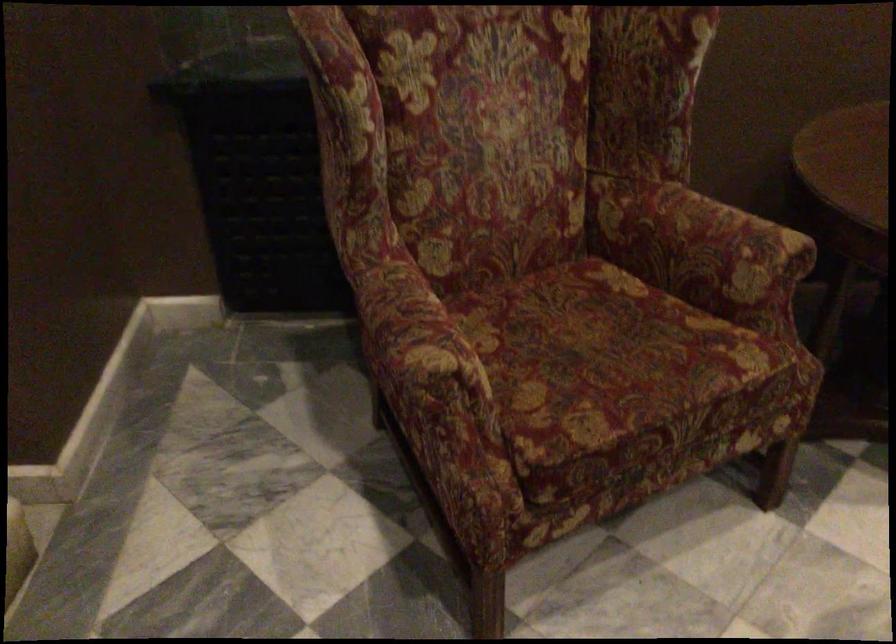
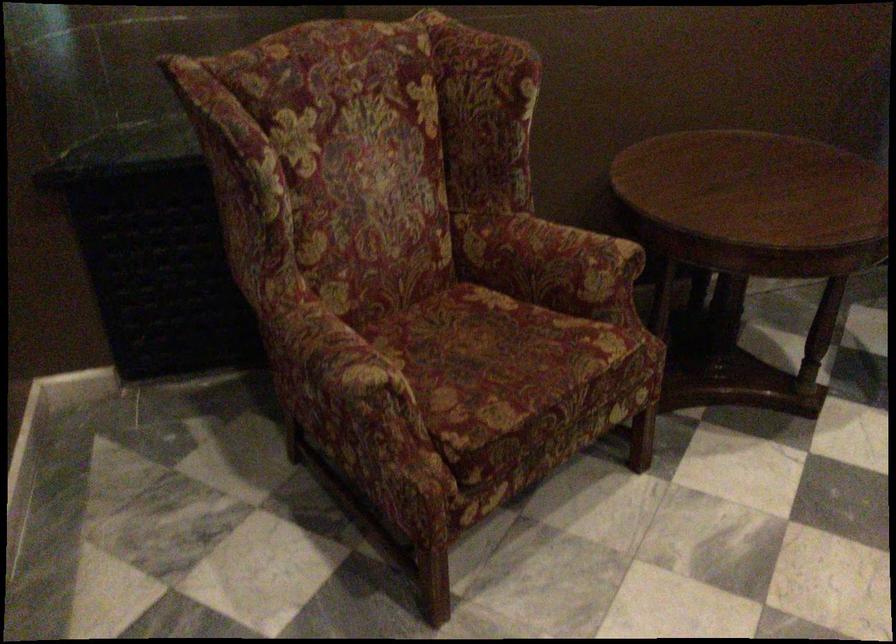
Find the pixel in the second image that matches [719,245] in the first image.

(572, 256)